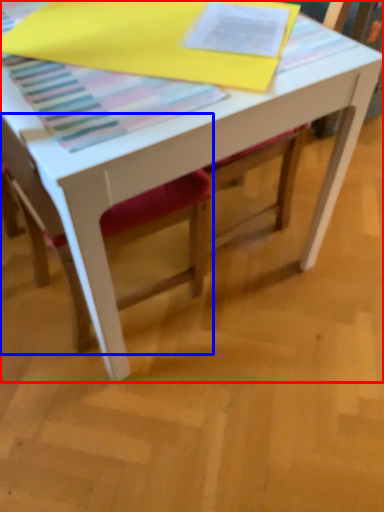
Question: Which point is further to the camera, table (highlighted by a red box) or chair (highlighted by a blue box)?

Choices:
 (A) table
 (B) chair

Answer: (A)